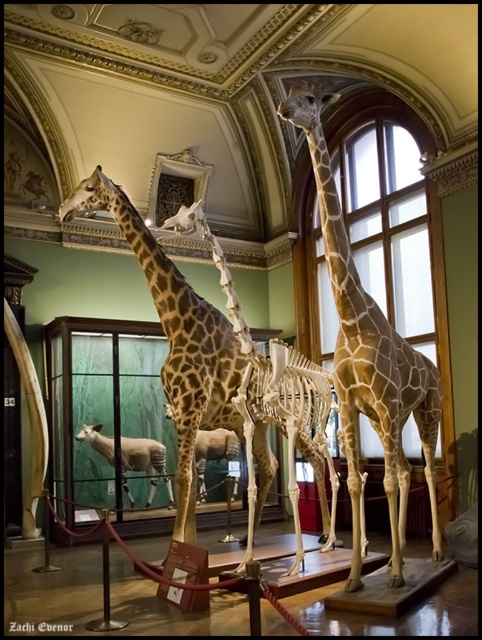
Is light brown spotted giraffe at center smaller than brown spotted giraffe at center?

Incorrect, light brown spotted giraffe at center is not smaller in size than brown spotted giraffe at center.

Who is more distant from viewer, (303, 92) or (190, 477)?

The point (190, 477) is more distant.

Between point (398, 385) and point (72, 202), which one is positioned behind?

The point (72, 202) is behind.

Image resolution: width=482 pixels, height=640 pixels. Identify the location of light brown spotted giraffe at center. (369, 360).

Which of these two, brown spotted giraffe at center or white woolen sheep at center, stands shorter?

white woolen sheep at center is shorter.

Does brown spotted giraffe at center have a greater height compared to white woolen sheep at center?

Correct, brown spotted giraffe at center is much taller as white woolen sheep at center.

Which is in front, point (227, 344) or point (169, 492)?

Point (227, 344)

The image size is (482, 640). Identify the location of brown spotted giraffe at center. (175, 339).

Is brown spotted skeleton at center to the right of brown spotted giraffe at center from the viewer's perspective?

Yes, brown spotted skeleton at center is to the right of brown spotted giraffe at center.

Which is more to the left, brown spotted skeleton at center or brown spotted giraffe at center?

Positioned to the left is brown spotted giraffe at center.

Is point (317, 480) more distant than point (222, 339)?

That is True.

Find the location of a particular element. Image resolution: width=482 pixels, height=640 pixels. brown spotted skeleton at center is located at coordinates (248, 392).